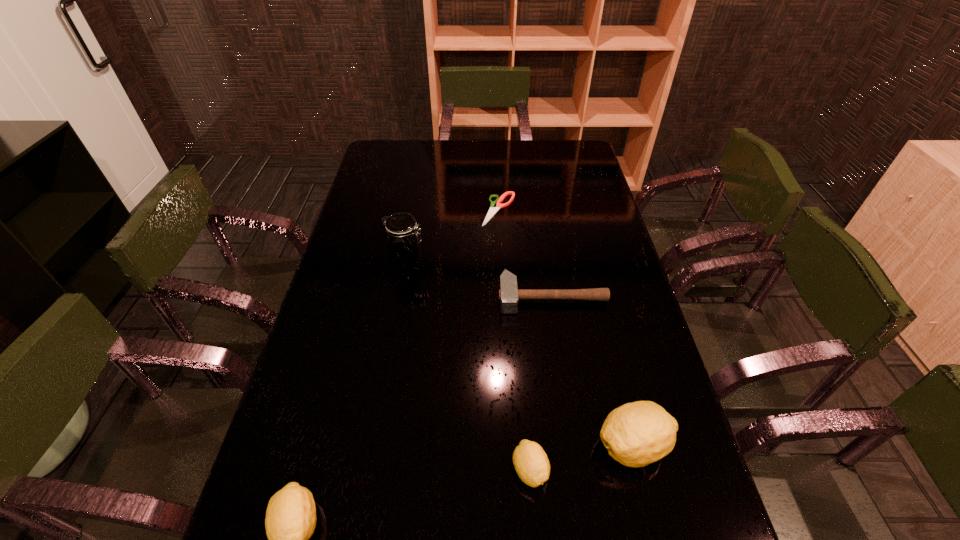
Where is `object that is the fourth nearest to the tallest object`? object that is the fourth nearest to the tallest object is located at coordinates click(636, 434).

Where is `object that stands as the fourth closest to the leftmost object`? This screenshot has height=540, width=960. object that stands as the fourth closest to the leftmost object is located at coordinates (404, 238).

You are a GUI agent. You are given a task and a screenshot of the screen. Output one action in this format:
    pyautogui.click(x=<x>, y=<y>)
    Task: Click on the lemon that is the closest to the third shortest object
    The width and height of the screenshot is (960, 540).
    Given the screenshot: What is the action you would take?
    pyautogui.click(x=636, y=434)

I want to click on the closest lemon to the fourth shortest object, so click(x=531, y=463).